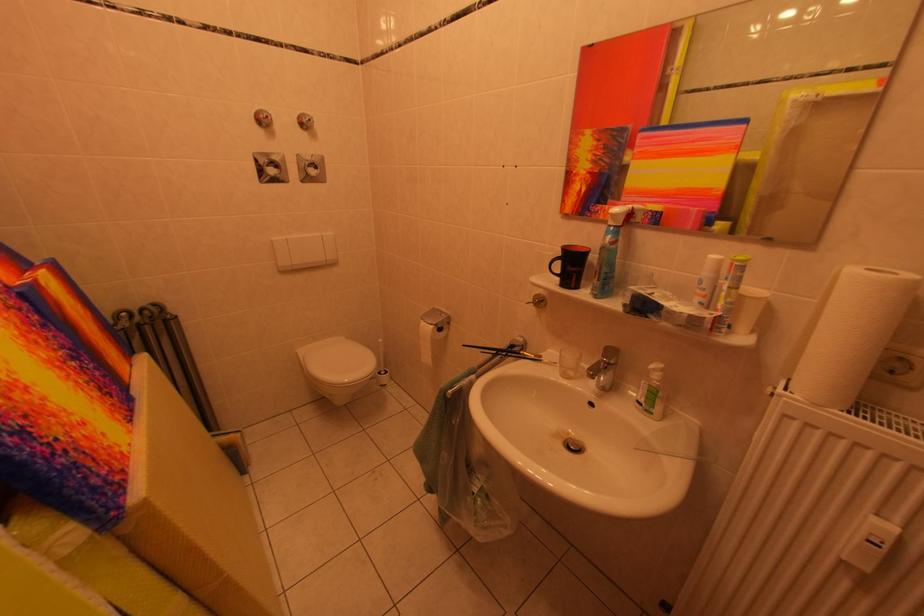
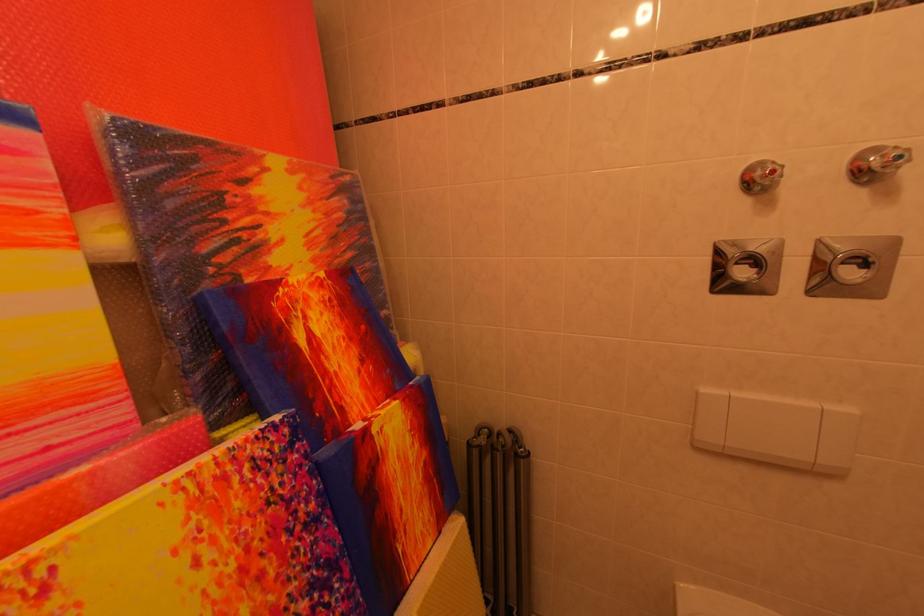
The point at (320, 123) is marked in the first image. Where is the corresponding point in the second image?

(907, 161)